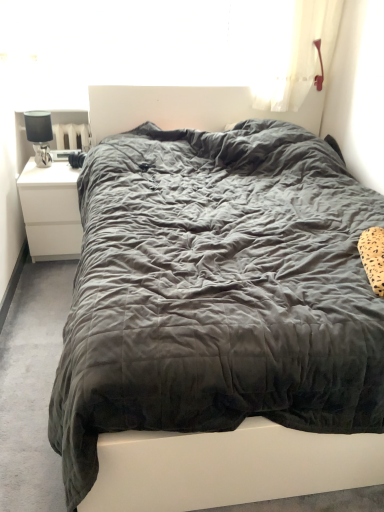
The height and width of the screenshot is (512, 384). What do you see at coordinates (219, 302) in the screenshot?
I see `dark grey quilted bed at center` at bounding box center [219, 302].

Where is `white matte nightstand at left`? white matte nightstand at left is located at coordinates (51, 211).

You are a GUI agent. You are given a task and a screenshot of the screen. Output one action in this format:
    pyautogui.click(x=<x>, y=<y>)
    Task: Click on the transparent plastic window screen at upper center
    The height and width of the screenshot is (512, 384).
    Given the screenshot: What is the action you would take?
    pyautogui.click(x=145, y=40)

Between dark grey quilted bed at center and white matte nightstand at left, which one has smaller size?

white matte nightstand at left is smaller.

From a real-world perspective, is dark grey quilted bed at center positioned under white matte nightstand at left based on gravity?

No.

Are dark grey quilted bed at center and white matte nightstand at left making contact?

No, dark grey quilted bed at center is not next to white matte nightstand at left.

Is point (152, 352) closer to camera compared to point (81, 229)?

Yes, point (152, 352) is closer to viewer.

Is white matte nightstand at left not close to satin black lamp at left?

No, white matte nightstand at left is in close proximity to satin black lamp at left.

In the scene shown: Relative to satin black lamp at left, is white matte nightstand at left in front or behind?

Visually, white matte nightstand at left is located in front of satin black lamp at left.

Would you say white matte nightstand at left is to the left or to the right of satin black lamp at left in the picture?

Clearly, white matte nightstand at left is on the right of satin black lamp at left in the image.

Considering the relative sizes of white matte nightstand at left and satin black lamp at left in the image provided, is white matte nightstand at left shorter than satin black lamp at left?

No, white matte nightstand at left is not shorter than satin black lamp at left.

From the image's perspective, which is above, white matte nightstand at left or dark grey quilted bed at center?

white matte nightstand at left.

Does white matte nightstand at left appear on the right side of dark grey quilted bed at center?

Incorrect, white matte nightstand at left is not on the right side of dark grey quilted bed at center.

Does point (34, 179) lie behind point (76, 275)?

Yes, point (34, 179) is farther from viewer.

Can you confirm if white matte nightstand at left is smaller than dark grey quilted bed at center?

Indeed, white matte nightstand at left has a smaller size compared to dark grey quilted bed at center.

In terms of height, does satin black lamp at left look taller or shorter compared to transparent plastic window screen at upper center?

In the image, satin black lamp at left appears to be shorter than transparent plastic window screen at upper center.

How far apart are satin black lamp at left and transparent plastic window screen at upper center?

satin black lamp at left is 32.30 inches away from transparent plastic window screen at upper center.

Which is behind, point (50, 117) or point (257, 50)?

Positioned behind is point (50, 117).

Does satin black lamp at left have a greater width compared to transparent plastic window screen at upper center?

No.

From the image's perspective, is satin black lamp at left below dark grey quilted bed at center?

No, from the image's perspective, satin black lamp at left is not beneath dark grey quilted bed at center.

Is satin black lamp at left turned away from dark grey quilted bed at center?

No, satin black lamp at left is not facing the opposite direction of dark grey quilted bed at center.

Between point (38, 156) and point (342, 221), which one is positioned in front?

The point (342, 221) is closer to the camera.

From the image's perspective, relative to satin black lamp at left, is dark grey quilted bed at center above or below?

Clearly, from the image's perspective, dark grey quilted bed at center is below satin black lamp at left.

I want to click on bed that appears below the satin black lamp at left (from the image's perspective), so click(219, 302).

Is dark grey quilted bed at center turned away from satin black lamp at left?

No, dark grey quilted bed at center is not facing the opposite direction of satin black lamp at left.

Is dark grey quilted bed at center closer to camera compared to satin black lamp at left?

Yes, dark grey quilted bed at center is closer to the camera.

From the image's perspective, is transparent plastic window screen at upper center located above dark grey quilted bed at center?

Yes, from the image's perspective, transparent plastic window screen at upper center is above dark grey quilted bed at center.

Looking at this image, in terms of height, does transparent plastic window screen at upper center look taller or shorter compared to dark grey quilted bed at center?

Considering their sizes, transparent plastic window screen at upper center has less height than dark grey quilted bed at center.

Which of these two, transparent plastic window screen at upper center or dark grey quilted bed at center, is wider?

dark grey quilted bed at center is wider.

Who is bigger, transparent plastic window screen at upper center or dark grey quilted bed at center?

Bigger between the two is dark grey quilted bed at center.

There is a white matte nightstand at left. At what (x,y) coordinates should I click in order to perform the action: click on bed above it (from a real-world perspective). Please return your answer as a coordinate pair (x, y). This screenshot has width=384, height=512. Looking at the image, I should click on (219, 302).

Locate an element on the screen. This screenshot has height=512, width=384. lamp that appears on the left of white matte nightstand at left is located at coordinates [x=39, y=135].

Considering their positions, is satin black lamp at left positioned further to white matte nightstand at left than dark grey quilted bed at center?

The object further to white matte nightstand at left is dark grey quilted bed at center.

Considering their positions, is satin black lamp at left positioned closer to white matte nightstand at left than transparent plastic window screen at upper center?

satin black lamp at left is positioned closer to the anchor white matte nightstand at left.

Which object lies nearer to the anchor point transparent plastic window screen at upper center, dark grey quilted bed at center or satin black lamp at left?

satin black lamp at left lies closer to transparent plastic window screen at upper center than the other object.

Estimate the real-world distances between objects in this image. Which object is closer to satin black lamp at left, dark grey quilted bed at center or transparent plastic window screen at upper center?

transparent plastic window screen at upper center is closer to satin black lamp at left.

Which object lies further to the anchor point white matte nightstand at left, transparent plastic window screen at upper center or dark grey quilted bed at center?

transparent plastic window screen at upper center lies further to white matte nightstand at left than the other object.

Looking at the image, which one is located closer to white matte nightstand at left, transparent plastic window screen at upper center or satin black lamp at left?

The object closer to white matte nightstand at left is satin black lamp at left.

Looking at this image, based on their spatial positions, is transparent plastic window screen at upper center or dark grey quilted bed at center further from satin black lamp at left?

dark grey quilted bed at center.

Based on their spatial positions, is dark grey quilted bed at center or satin black lamp at left closer to white matte nightstand at left?

Among the two, satin black lamp at left is located nearer to white matte nightstand at left.

What are the coordinates of `lamp positioned between dark grey quilted bed at center and transparent plastic window screen at upper center from near to far` in the screenshot? It's located at (39, 135).

What are the coordinates of `nightstand between dark grey quilted bed at center and transparent plastic window screen at upper center from front to back` in the screenshot? It's located at (51, 211).

Locate an element on the screen. lamp between transparent plastic window screen at upper center and white matte nightstand at left in the up-down direction is located at coordinates (39, 135).

You are a GUI agent. You are given a task and a screenshot of the screen. Output one action in this format:
    pyautogui.click(x=<x>, y=<y>)
    Task: Click on the nightstand between dark grey quilted bed at center and satin black lamp at left from front to back
    
    Given the screenshot: What is the action you would take?
    pyautogui.click(x=51, y=211)